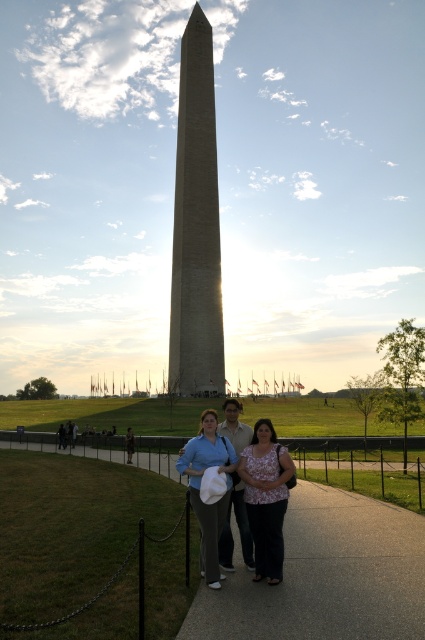
Question: Which point is farther to the camera?

Choices:
 (A) (203, 566)
 (B) (198, 173)

Answer: (B)

Question: Which object is farther from the camera taking this photo?

Choices:
 (A) smooth white shirt at center
 (B) matte blue shirt at center
 (C) concrete sidewalk at center
 (D) brown stone tower at center

Answer: (D)

Question: Which is farther from the floral blouse at center?

Choices:
 (A) smooth white shirt at center
 (B) concrete sidewalk at center

Answer: (B)

Question: Can you confirm if floral blouse at center is positioned above matte blue shirt at center?

Choices:
 (A) yes
 (B) no

Answer: (B)

Question: Is matte blue shirt at center thinner than smooth white shirt at center?

Choices:
 (A) yes
 (B) no

Answer: (B)

Question: Does floral blouse at center have a lesser width compared to matte blue shirt at center?

Choices:
 (A) no
 (B) yes

Answer: (B)